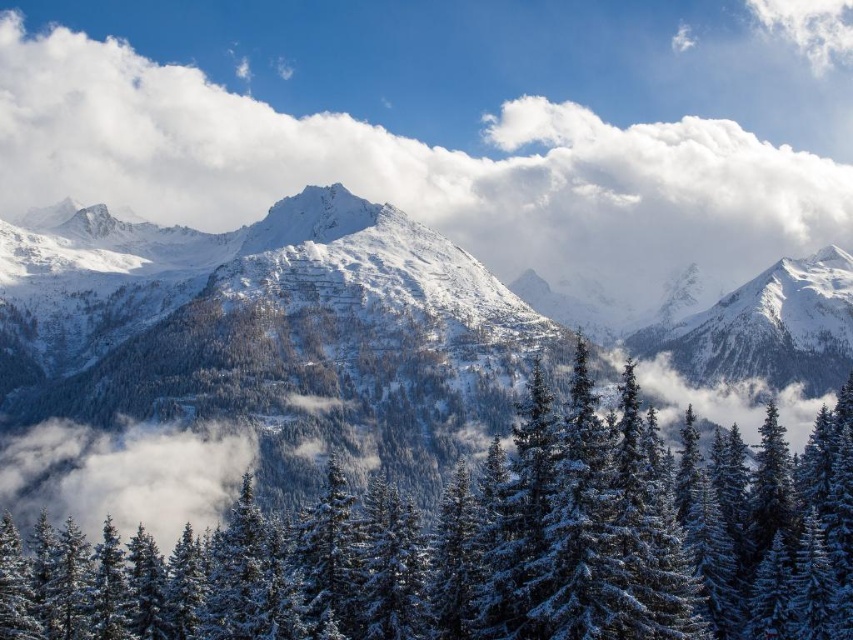
Can you confirm if white fluffy cloud at upper center is positioned above white snow-covered peak at center?

Yes, white fluffy cloud at upper center is above white snow-covered peak at center.

Where is `white fluffy cloud at upper center`? The height and width of the screenshot is (640, 853). white fluffy cloud at upper center is located at coordinates click(x=421, y=164).

Does snow-covered pine trees at center have a greater height compared to white fluffy cloud at lower left?

Indeed, snow-covered pine trees at center has a greater height compared to white fluffy cloud at lower left.

Find the location of a particular element. snow-covered pine trees at center is located at coordinates (490, 545).

Does snow-covered pine trees at center appear over white fluffy cloud at upper center?

No, snow-covered pine trees at center is not above white fluffy cloud at upper center.

Which is more to the right, snow-covered pine trees at center or white fluffy cloud at upper center?

snow-covered pine trees at center is more to the right.

Locate an element on the screen. This screenshot has height=640, width=853. snow-covered pine trees at center is located at coordinates (490, 545).